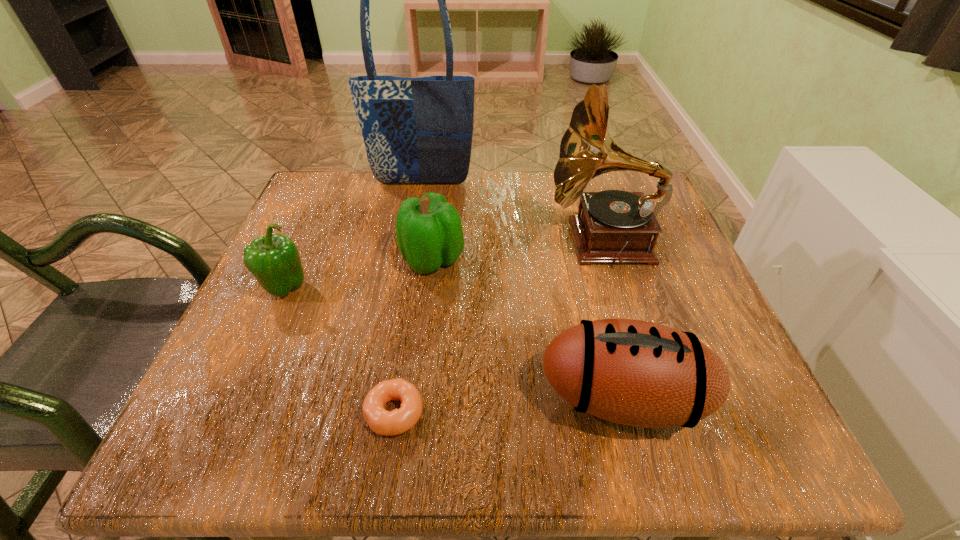
Find the location of `bell pepper that is at the left edge`. bell pepper that is at the left edge is located at coordinates (274, 260).

At what (x,y) coordinates should I click in order to perform the action: click on phonograph_record located in the right edge section of the desktop. Please return your answer as a coordinate pair (x, y). The height and width of the screenshot is (540, 960). Looking at the image, I should click on (616, 226).

You are a GUI agent. You are given a task and a screenshot of the screen. Output one action in this format:
    pyautogui.click(x=<x>, y=<y>)
    Task: Click on the football (American) that is positioned at the right edge
    The width and height of the screenshot is (960, 540).
    Given the screenshot: What is the action you would take?
    pyautogui.click(x=637, y=373)

Locate an element on the screen. object situated at the far left corner is located at coordinates (419, 130).

At what (x,y) coordinates should I click in order to perform the action: click on object that is at the far right corner. Please return your answer as a coordinate pair (x, y). Looking at the image, I should click on (616, 226).

The width and height of the screenshot is (960, 540). Find the location of `object that is at the near right corner`. object that is at the near right corner is located at coordinates (637, 373).

This screenshot has height=540, width=960. In the image, there is a desktop. What are the coordinates of `vacant space at the far edge` in the screenshot? It's located at (440, 185).

At what (x,y) coordinates should I click in order to perform the action: click on vacant space at the near edge of the desktop. Please return your answer as a coordinate pair (x, y). This screenshot has height=540, width=960. Looking at the image, I should click on (634, 445).

This screenshot has width=960, height=540. In the image, there is a desktop. What are the coordinates of `free space at the left edge` in the screenshot? It's located at (241, 364).

In the image, there is a desktop. At what (x,y) coordinates should I click in order to perform the action: click on vacant region at the far left corner. Please return your answer as a coordinate pair (x, y). The height and width of the screenshot is (540, 960). Looking at the image, I should click on (326, 208).